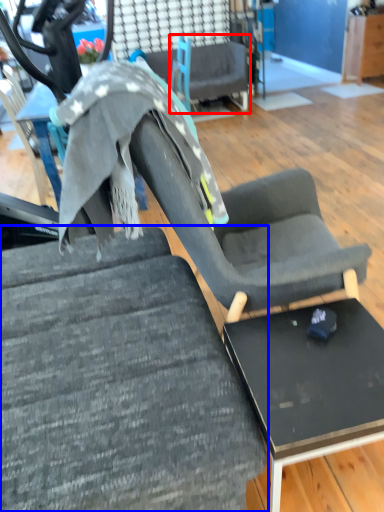
Question: Which point is further to the camera, chair (highlighted by a red box) or chair (highlighted by a blue box)?

Choices:
 (A) chair
 (B) chair

Answer: (A)